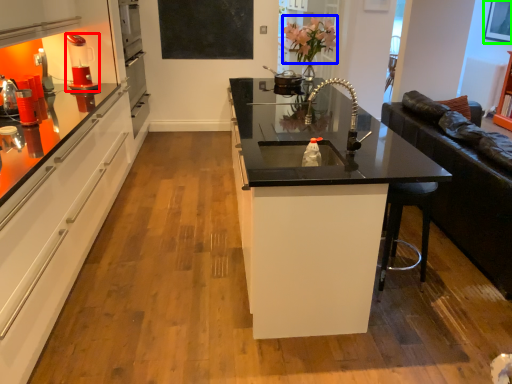
Question: Which is farther away from coffee machine (highlighted by a red box)? flower (highlighted by a blue box) or picture frame (highlighted by a green box)?

Choices:
 (A) flower
 (B) picture frame

Answer: (B)